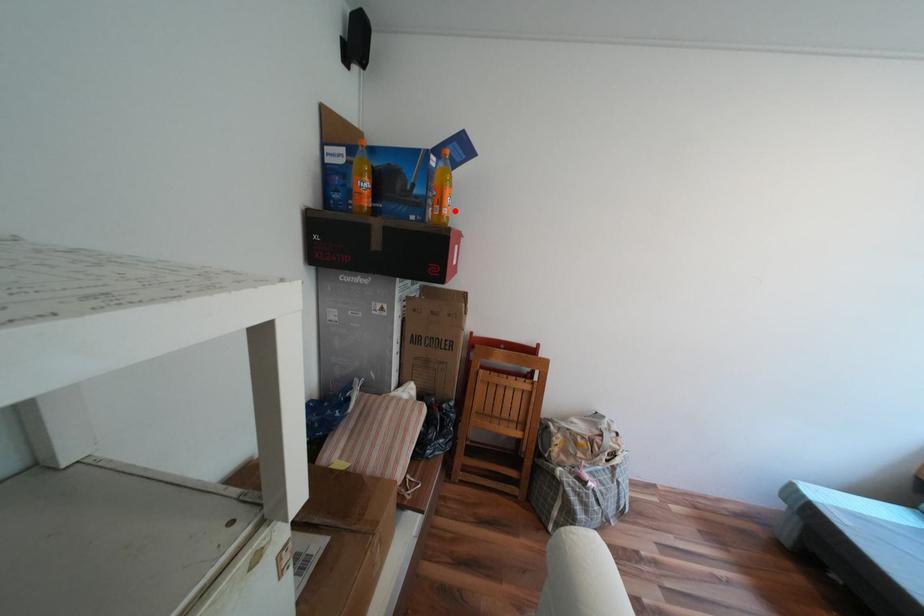
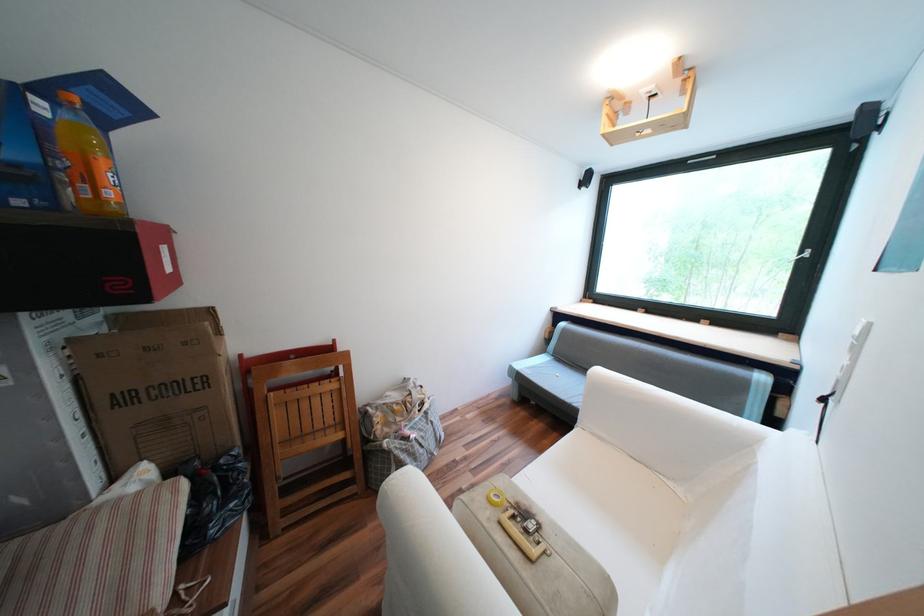
Locate, in the second image, the point that corresponds to the highlighted location in the first image.

(118, 193)